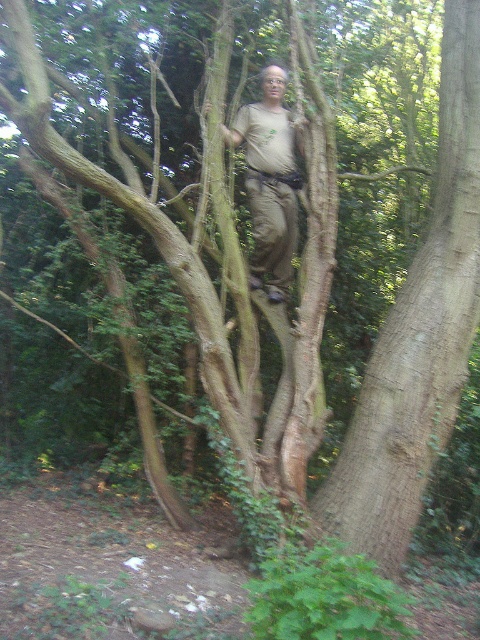
You are a hiker trying to climb the tree. The brown rough tree trunk at center and the light brown fabric shirt at center are in your view. Which object is located to the right side from your perspective?

The brown rough tree trunk at center is to the right of the light brown fabric shirt at center, so the brown rough tree trunk at center is located to the right side from your perspective.

You are a hiker who wants to take a photo of the brown rough tree trunk at center and the light brown fabric shirt at center. Which object should you zoom in on to capture more details in your photo?

The brown rough tree trunk at center is larger in size than the light brown fabric shirt at center, so you should zoom in on the light brown fabric shirt at center to capture more details.